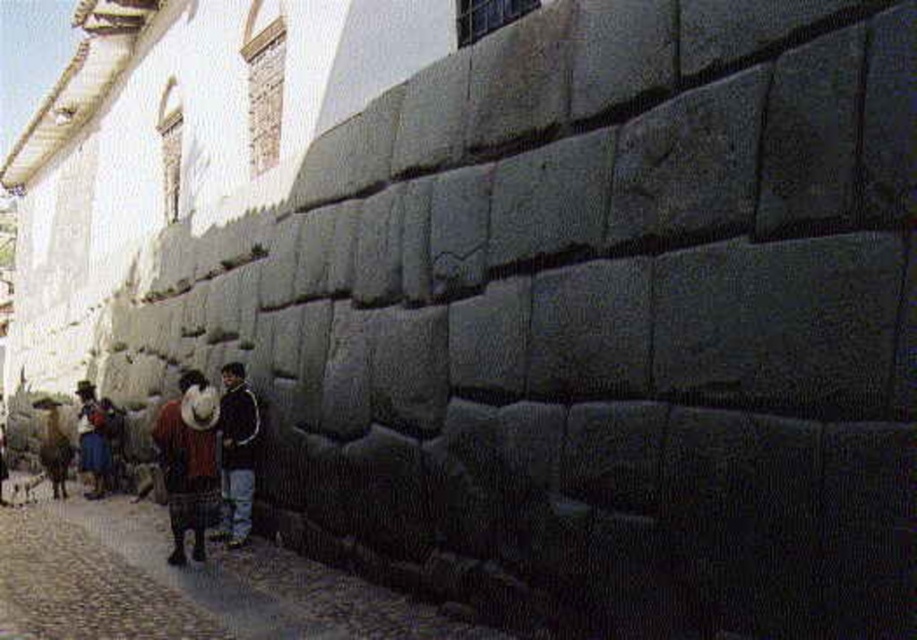
Question: From the image, what is the correct spatial relationship of knitted wool sweater at center in relation to blue woven fabric at lower left?

Choices:
 (A) right
 (B) left

Answer: (A)

Question: Which point is closer to the camera?

Choices:
 (A) pyautogui.click(x=97, y=406)
 (B) pyautogui.click(x=3, y=563)

Answer: (B)

Question: Which object is closer to the camera taking this photo?

Choices:
 (A) blue woven fabric at lower left
 (B) dark blue jacket at center
 (C) dark gray stone wall at lower left

Answer: (C)

Question: Which point appears closest to the camera in this image?

Choices:
 (A) (19, 547)
 (B) (196, 445)
 (C) (83, 461)

Answer: (B)

Question: Considering the relative positions of dark gray stone wall at lower left and blue woven fabric at lower left in the image provided, where is dark gray stone wall at lower left located with respect to blue woven fabric at lower left?

Choices:
 (A) below
 (B) above

Answer: (A)

Question: Is dark blue jacket at center further to the viewer compared to blue woven fabric at lower left?

Choices:
 (A) yes
 (B) no

Answer: (B)